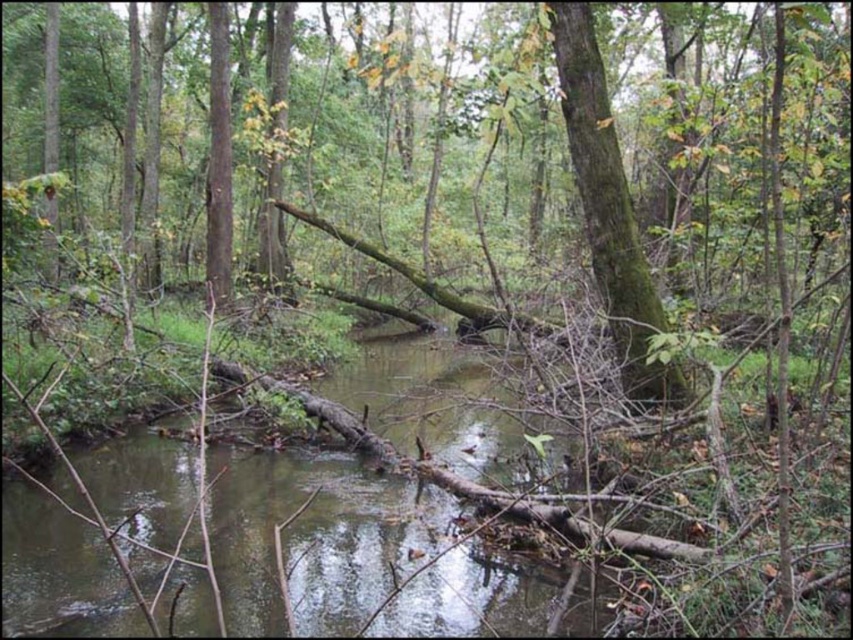
You are a hiker trying to cross the brown wood stream at center. You notice a green mossy tree trunk at center nearby. Which object is lower in elevation?

The brown wood stream at center is located below the green mossy tree trunk at center, so the stream is lower in elevation.

You are a hiker trying to cross the stream in the forest. You notice a point marked at coordinates (316, 536). What is located at that point?

At point (316, 536) lies brown wood stream at center.